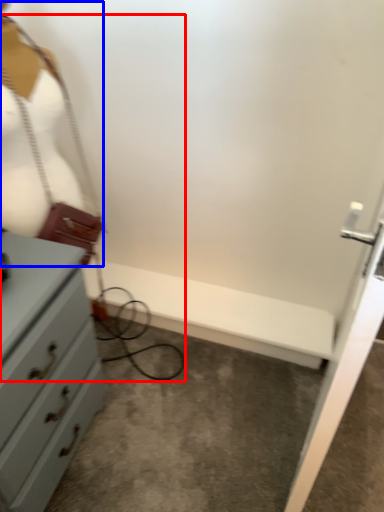
Question: Which object is further to the camera taking this photo, wire (highlighted by a red box) or mannequin (highlighted by a blue box)?

Choices:
 (A) wire
 (B) mannequin

Answer: (B)